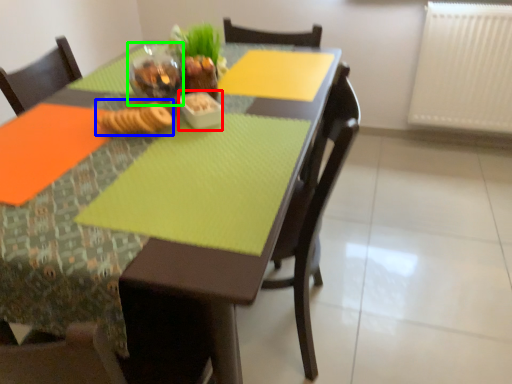
Question: Considering the real-world distances, which object is farthest from tableware (highlighted by a red box)? food (highlighted by a blue box) or tableware (highlighted by a green box)?

Choices:
 (A) food
 (B) tableware

Answer: (B)